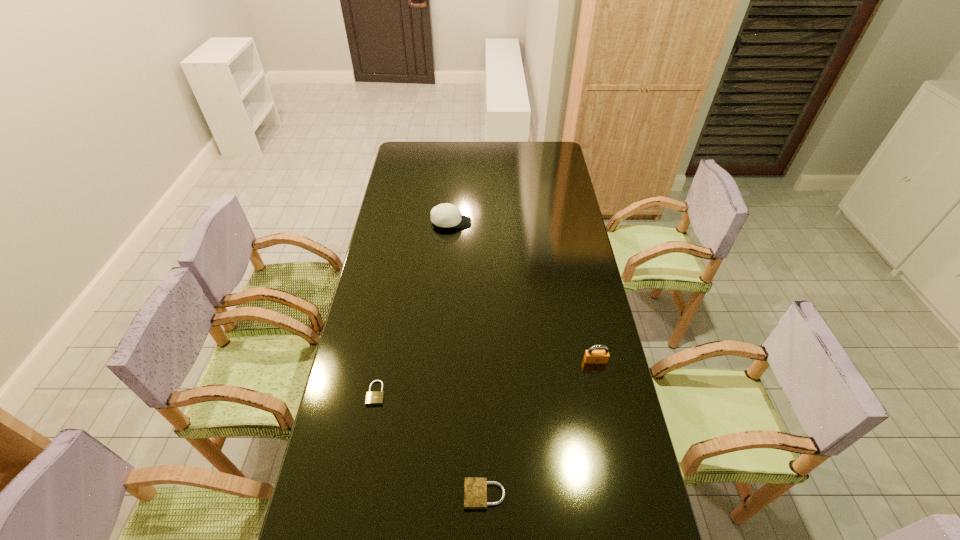
Locate an element on the screen. This screenshot has height=540, width=960. vacant space located on the keyhole side of the second shortest padlock is located at coordinates (434, 495).

This screenshot has height=540, width=960. I want to click on free space located 0.300m on the keyhole side of the second shortest padlock, so click(350, 495).

Locate an element on the screen. The height and width of the screenshot is (540, 960). free location located on the back of the leftmost padlock is located at coordinates (392, 306).

Locate an element on the screen. The image size is (960, 540). object present at the left edge is located at coordinates (372, 398).

Find the location of a particular element. The height and width of the screenshot is (540, 960). object at the right edge is located at coordinates (591, 356).

Where is `vacant space at the far edge of the desktop`? This screenshot has height=540, width=960. vacant space at the far edge of the desktop is located at coordinates (492, 153).

The height and width of the screenshot is (540, 960). In the image, there is a desktop. Identify the location of vacant space at the left edge. (332, 438).

This screenshot has height=540, width=960. In the image, there is a desktop. What are the coordinates of `vacant area at the right edge` in the screenshot? It's located at (610, 369).

This screenshot has height=540, width=960. Identify the location of vacant space at the far left corner of the desktop. (424, 145).

Identify the location of free space at the far right corner. This screenshot has height=540, width=960. (540, 147).